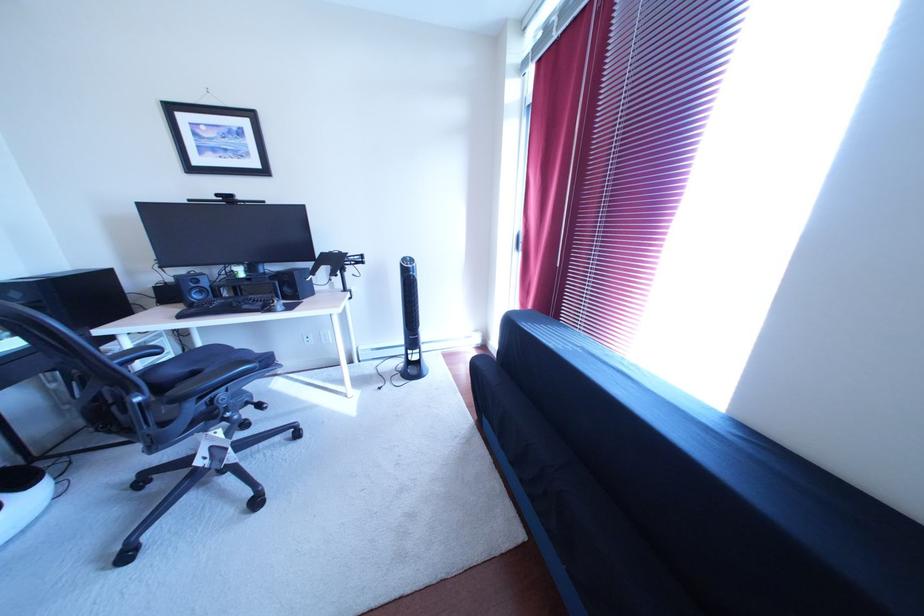
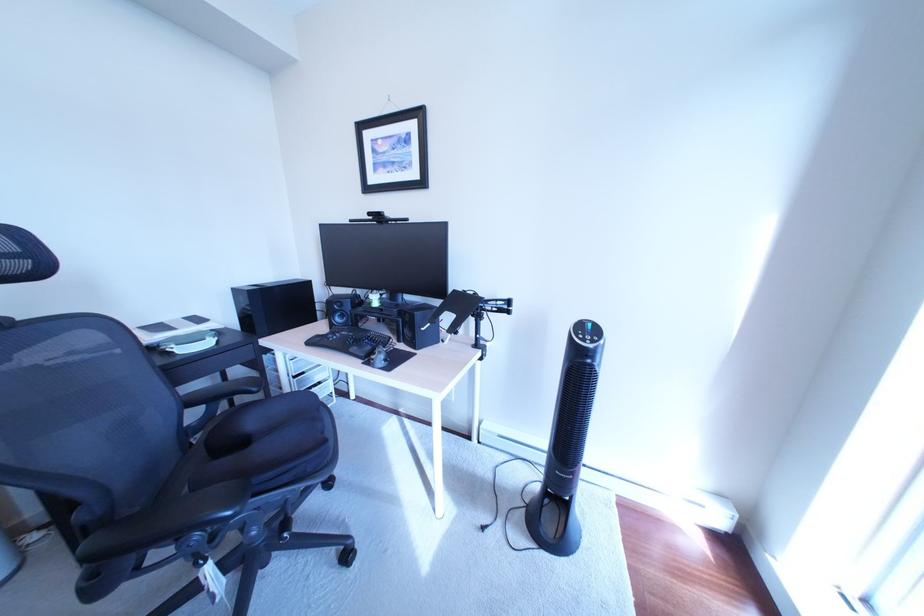
Question: Based on the continuous images, in which direction is the camera rotating? Reply with the corresponding letter.

Choices:
 (A) Left
 (B) Right
 (C) Up
 (D) Down

Answer: (A)